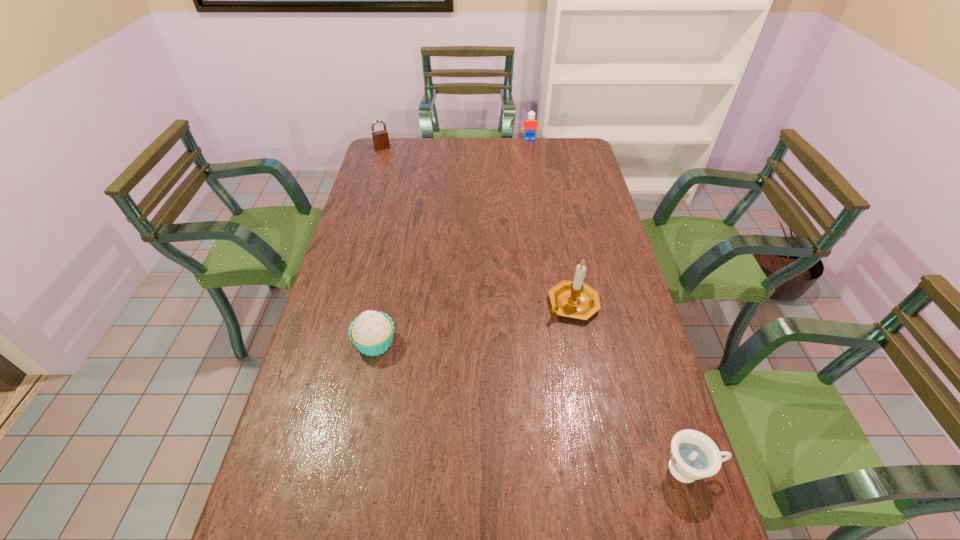
Image resolution: width=960 pixels, height=540 pixels. In order to click on Lego located in the far edge section of the desktop in this screenshot , I will do `click(530, 125)`.

The height and width of the screenshot is (540, 960). What are the coordinates of `object situated at the near edge` in the screenshot? It's located at (693, 456).

The image size is (960, 540). I want to click on cupcake that is at the left edge, so 371,332.

The height and width of the screenshot is (540, 960). I want to click on padlock that is at the left edge, so click(x=380, y=138).

Where is `teacup present at the right edge`? The width and height of the screenshot is (960, 540). teacup present at the right edge is located at coordinates (693, 456).

This screenshot has height=540, width=960. What are the coordinates of `candle holder located in the right edge section of the desktop` in the screenshot? It's located at (575, 299).

This screenshot has width=960, height=540. I want to click on object present at the far left corner, so click(x=380, y=138).

In order to click on object located in the near right corner section of the desktop in this screenshot , I will do `click(693, 456)`.

The width and height of the screenshot is (960, 540). I want to click on vacant space at the far edge of the desktop, so click(x=427, y=165).

Identify the location of vacant region at the left edge of the desktop. This screenshot has width=960, height=540. (361, 206).